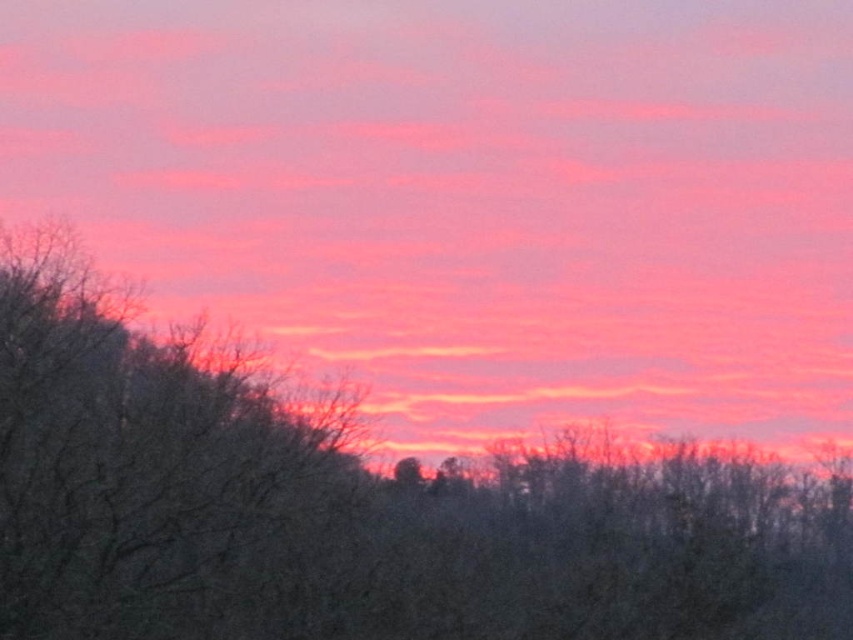
You are planning to place a bench between the brown matte tree at center and the brown textured tree at left. The bench is 6 feet long. Will there be enough space between them to fit the bench?

The distance between the brown matte tree at center and the brown textured tree at left is 6.93 feet. Since the bench is 6 feet long, there will be enough space to fit it between them with approximately 0.93 feet of extra space remaining.

You are an artist trying to paint the sunset scene. You need to decide the placement of the pink matte cloud at upper center and the brown textured tree at left. Based on the scene, which object should be placed higher in your painting?

The pink matte cloud at upper center should be placed higher in the painting since it has a greater height compared to the brown textured tree at left.